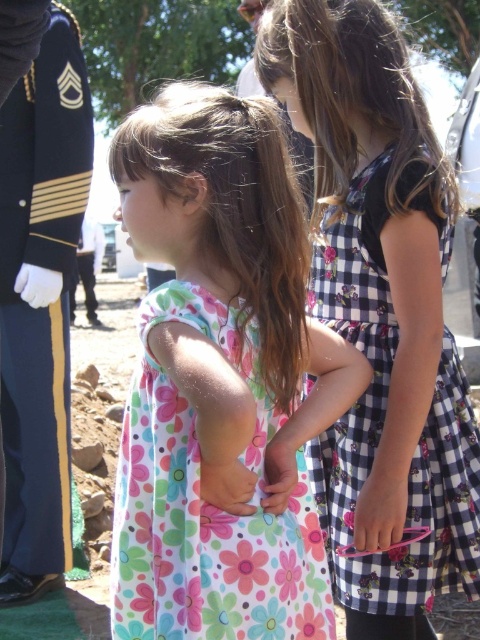
Question: Is checkered fabric dress at center bigger than matte floral dress at center?

Choices:
 (A) yes
 (B) no

Answer: (A)

Question: Which object is positioned closest to the checkered fabric dress at center?

Choices:
 (A) dark blue wool uniform at left
 (B) floral cotton dress at center

Answer: (B)

Question: Is pink fabric hand at center wider than floral fabric hand at center?

Choices:
 (A) yes
 (B) no

Answer: (A)

Question: Which object is farther from the camera taking this photo?

Choices:
 (A) floral cotton dress at center
 (B) floral fabric hand at center
 (C) checkered fabric dress at center
 (D) dark blue wool uniform at left

Answer: (D)

Question: Which point is farther from the camera taking this photo?

Choices:
 (A) (202, 493)
 (B) (254, 340)
 (C) (290, 461)
 (D) (374, 509)

Answer: (D)

Question: Can you confirm if dark blue wool uniform at left is positioned to the left of matte floral dress at center?

Choices:
 (A) yes
 (B) no

Answer: (A)